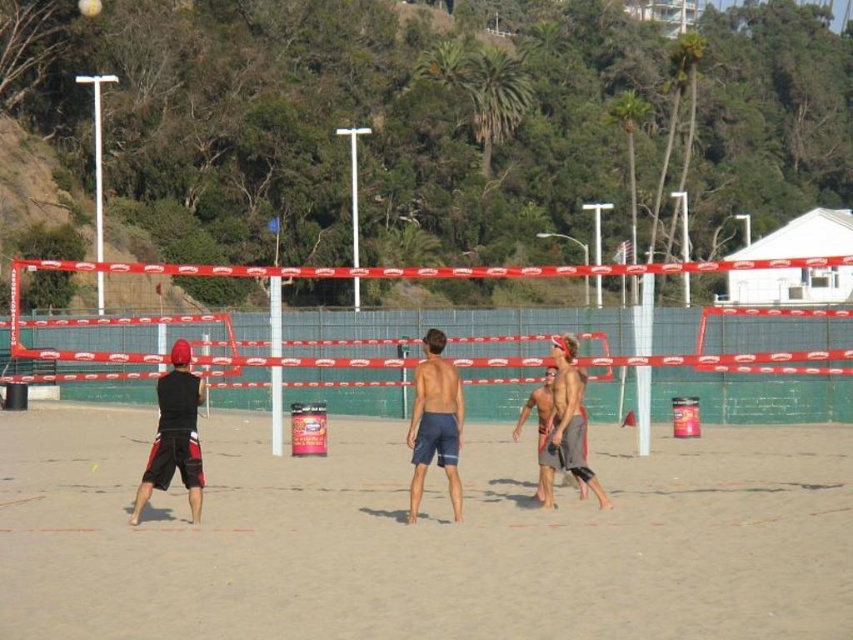
Looking at this image, is sandy beach at center positioned before white matte volleyball at center?

Yes, sandy beach at center is closer to the viewer.

Which is more to the left, sandy beach at center or white matte volleyball at center?

Positioned to the left is white matte volleyball at center.

Does point (535, 608) lie in front of point (79, 4)?

Yes, it is.

You are a GUI agent. You are given a task and a screenshot of the screen. Output one action in this format:
    pyautogui.click(x=<x>, y=<y>)
    Task: Click on the sandy beach at center
    
    Given the screenshot: What is the action you would take?
    pyautogui.click(x=422, y=538)

Between point (577, 376) and point (86, 4), which one is positioned in front?

Point (577, 376)

Who is more distant from viewer, (x=549, y=445) or (x=100, y=3)?

Positioned behind is point (x=100, y=3).

This screenshot has height=640, width=853. In order to click on matte gray shorts at center in this screenshot , I will do `click(567, 424)`.

What do you see at coordinates (538, 410) in the screenshot? The width and height of the screenshot is (853, 640). I see `tan skin shirtless man at center` at bounding box center [538, 410].

Between point (537, 451) and point (90, 8), which one is positioned in front?

Point (537, 451)

Identify the location of tan skin shirtless man at center. (538, 410).